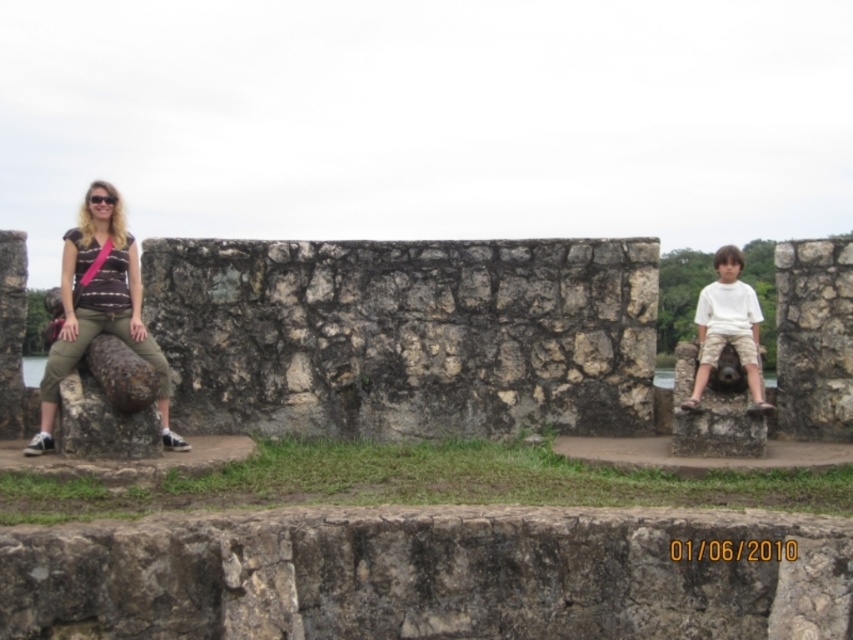
You are a photographer trying to capture the scene described. You want to position your camera at the center of the image to frame both the matte black shirt at left and the other person. Where should you aim your camera to ensure both subjects are in the frame?

To ensure both the matte black shirt at left and the other person are in the frame, aim your camera at the center of the image, as the matte black shirt at left is positioned at point (x=99, y=307), which is close to the center coordinates. This central positioning will help include both subjects within the camera frame.

You are a photographer planning to take a group photo of the matte black shirt at left and the white cotton shirt at right. Based on their positions and sizes, which shirt should be placed closer to the camera to ensure both appear equally sized in the photo?

The matte black shirt at left might be wider than the white cotton shirt at right, so to make them appear the same size in the photo, the white cotton shirt at right should be moved closer to the camera.